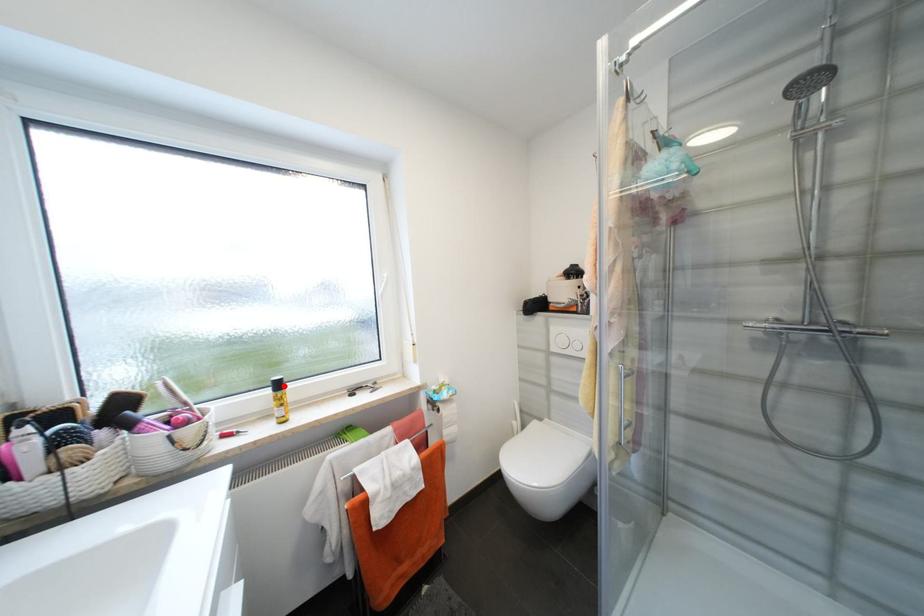
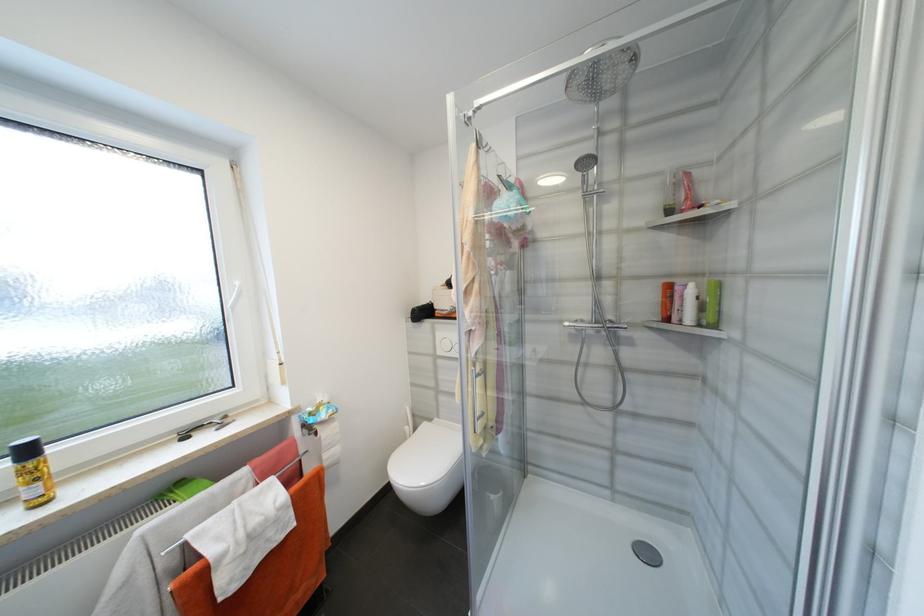
Find the pixel in the second image that matches the highlighted location in the first image.

(33, 453)